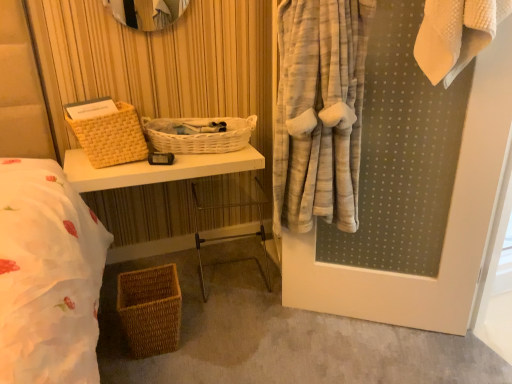
Find the location of `vacant space in front of woven brown basket at lower left, which is counted as the third basket, starting from the top`. vacant space in front of woven brown basket at lower left, which is counted as the third basket, starting from the top is located at coordinates (146, 372).